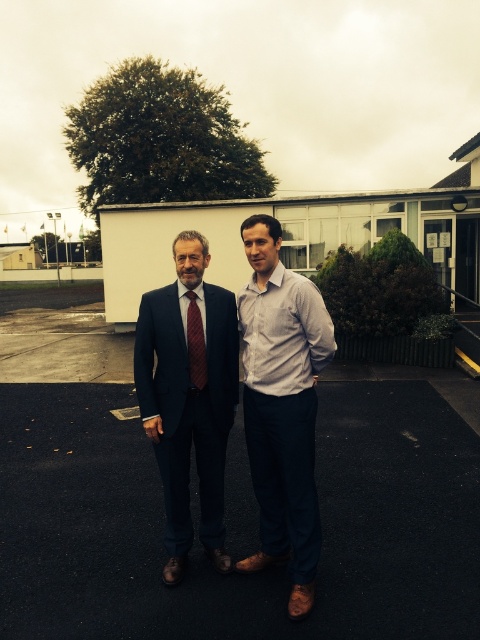
You are a photographer trying to capture a group photo of the two people in the scene. You want to ensure that the light gray cotton shirt at center is visible in the frame. Where should you position the camera relative to the point marked by the coordinate point [282,404]?

The light gray cotton shirt at center is represented by the point [282,404], so positioning the camera directly at that point would center the shirt in the frame, ensuring it is clearly visible.